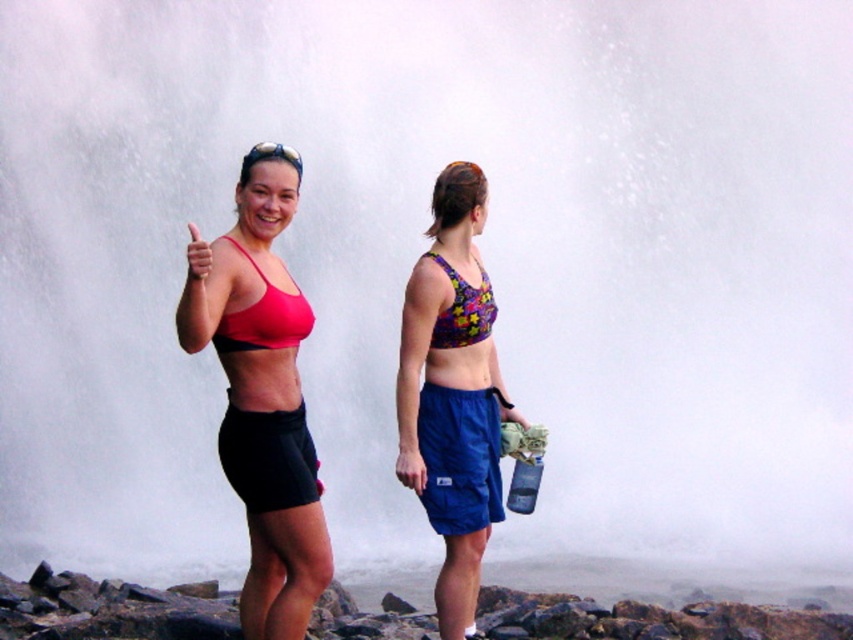
You are a photographer trying to capture a photo of both the blue fabric shorts at lower center and the floral fabric bikini top at center. Based on their heights, which object should you focus on first to ensure both are in frame?

The blue fabric shorts at lower center is much taller than the floral fabric bikini top at center, so you should focus on the blue fabric shorts at lower center first to ensure both are in frame.

You are a photographer positioned at the camera location. You want to capture a closeup shot of the blue fabric shorts at lower center. Considering the distance, do you need to use a zoom lens to focus on it?

The blue fabric shorts at lower center is 11.46 meters away from camera, so you need to use a zoom lens to focus on it.

You are a photographer trying to capture the floral fabric sports bra at center in the image. Given its coordinates at point 0.616, 0.531, where exactly should you focus your camera to ensure it is in the frame?

The floral fabric sports bra at center is located at point (451, 394), so you should focus your camera at those coordinates to ensure it is centered in the frame.